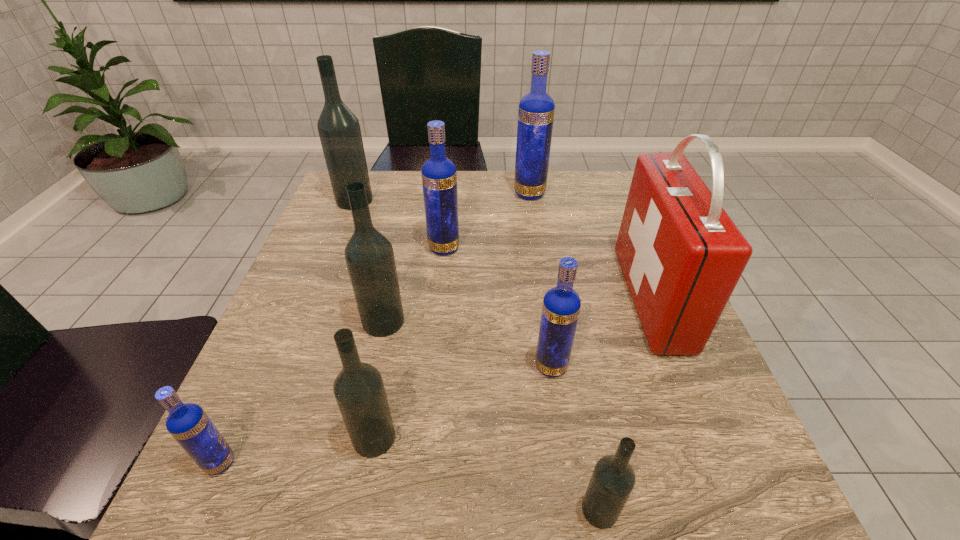
Locate an element on the screen. The width and height of the screenshot is (960, 540). black vodka that can be found as the closest to the smallest black vodka is located at coordinates (359, 390).

Where is `vacant space that satisfies the following two spatial constraints: 1. on the front face of the red first-aid kit; 2. on the front side of the third farthest black vodka`? The width and height of the screenshot is (960, 540). vacant space that satisfies the following two spatial constraints: 1. on the front face of the red first-aid kit; 2. on the front side of the third farthest black vodka is located at coordinates (708, 438).

At what (x,y) coordinates should I click in order to perform the action: click on free space that satisfies the following two spatial constraints: 1. on the back side of the farthest black vodka; 2. on the right side of the biggest blue vodka. Please return your answer as a coordinate pair (x, y). Looking at the image, I should click on (357, 194).